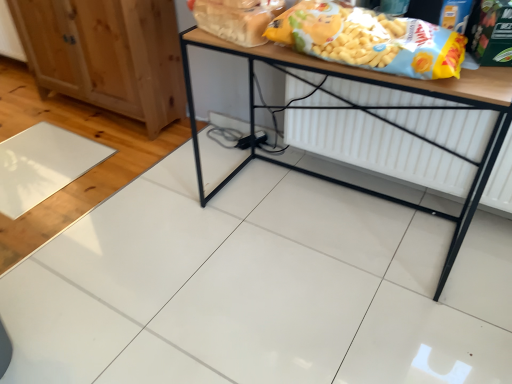
Question: From a real-world perspective, is yellow matte cereal at upper right, acting as the first cereal starting from the right, located higher than natural wood cabinet at left?

Choices:
 (A) no
 (B) yes

Answer: (B)

Question: Considering the relative sizes of yellow matte cereal at upper right, acting as the first cereal starting from the right, and natural wood cabinet at left in the image provided, is yellow matte cereal at upper right, acting as the first cereal starting from the right, taller than natural wood cabinet at left?

Choices:
 (A) yes
 (B) no

Answer: (B)

Question: Is yellow matte cereal at upper right, positioned as the second cereal in left-to-right order, at the left side of natural wood cabinet at left?

Choices:
 (A) yes
 (B) no

Answer: (B)

Question: From a real-world perspective, is yellow matte cereal at upper right, acting as the first cereal starting from the right, located beneath natural wood cabinet at left?

Choices:
 (A) no
 (B) yes

Answer: (A)

Question: Is natural wood cabinet at left at the back of yellow matte cereal at upper right, positioned as the second cereal in left-to-right order?

Choices:
 (A) yes
 (B) no

Answer: (B)

Question: From a real-world perspective, is wooden table at center positioned above or below translucent plastic bag of bread at upper center, positioned as the second cereal in right-to-left order?

Choices:
 (A) above
 (B) below

Answer: (B)

Question: Considering the positions of point (304, 168) and point (220, 11), is point (304, 168) closer or farther from the camera than point (220, 11)?

Choices:
 (A) closer
 (B) farther

Answer: (B)

Question: In terms of width, does wooden table at center look wider or thinner when compared to translucent plastic bag of bread at upper center, positioned as the second cereal in right-to-left order?

Choices:
 (A) wide
 (B) thin

Answer: (A)

Question: Is wooden table at center in front of or behind translucent plastic bag of bread at upper center, positioned as the second cereal in right-to-left order, in the image?

Choices:
 (A) behind
 (B) front

Answer: (B)

Question: In terms of width, does natural wood cabinet at left look wider or thinner when compared to wooden table at center?

Choices:
 (A) wide
 (B) thin

Answer: (B)

Question: Is point (162, 64) closer or farther from the camera than point (477, 86)?

Choices:
 (A) closer
 (B) farther

Answer: (B)

Question: From the image's perspective, is natural wood cabinet at left positioned above or below wooden table at center?

Choices:
 (A) above
 (B) below

Answer: (A)

Question: Is natural wood cabinet at left situated inside wooden table at center or outside?

Choices:
 (A) outside
 (B) inside

Answer: (A)

Question: From a real-world perspective, is wooden table at center above or below natural wood cabinet at left?

Choices:
 (A) below
 (B) above

Answer: (B)

Question: From the image's perspective, is wooden table at center positioned above or below natural wood cabinet at left?

Choices:
 (A) below
 (B) above

Answer: (A)